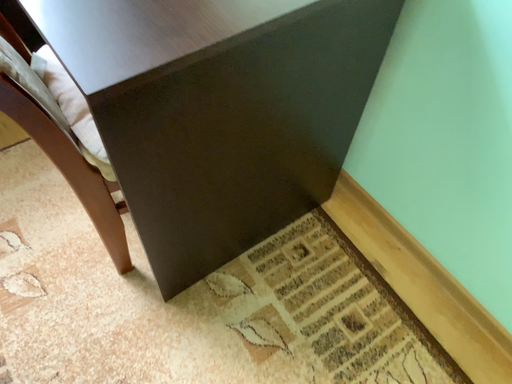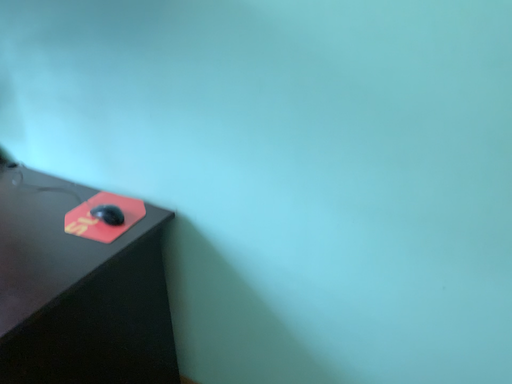
Question: Which way did the camera rotate in the video?

Choices:
 (A) rotated upward
 (B) rotated downward

Answer: (A)